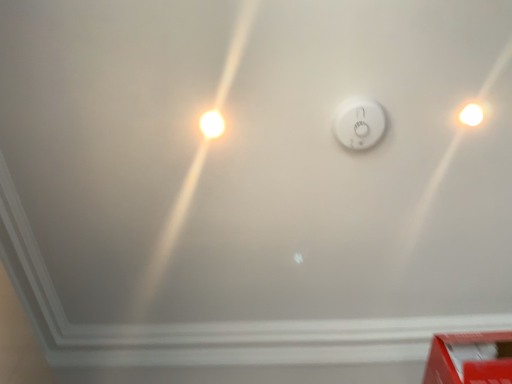
Question: Looking at their shapes, would you say white glossy light bulb at upper left, placed as the second light bulb when sorted from right to left, is wider or thinner than white glossy light bulb at upper right, the 1th light bulb in the right-to-left sequence?

Choices:
 (A) wide
 (B) thin

Answer: (B)

Question: From a real-world perspective, is white glossy light bulb at upper left, placed as the second light bulb when sorted from right to left, physically located above or below white glossy light bulb at upper right, marked as the second light bulb in a left-to-right arrangement?

Choices:
 (A) above
 (B) below

Answer: (B)

Question: Considering the real-world distances, which object is farthest from the white glossy light bulb at upper right, the 1th light bulb in the right-to-left sequence?

Choices:
 (A) red cardboard box at lower right
 (B) white plastic smoke detector at center
 (C) white glossy light bulb at upper left, the 1th light bulb from the left

Answer: (C)

Question: Considering the real-world distances, which object is farthest from the white plastic smoke detector at center?

Choices:
 (A) red cardboard box at lower right
 (B) white glossy light bulb at upper left, placed as the second light bulb when sorted from right to left
 (C) white glossy light bulb at upper right, the 1th light bulb in the right-to-left sequence

Answer: (A)